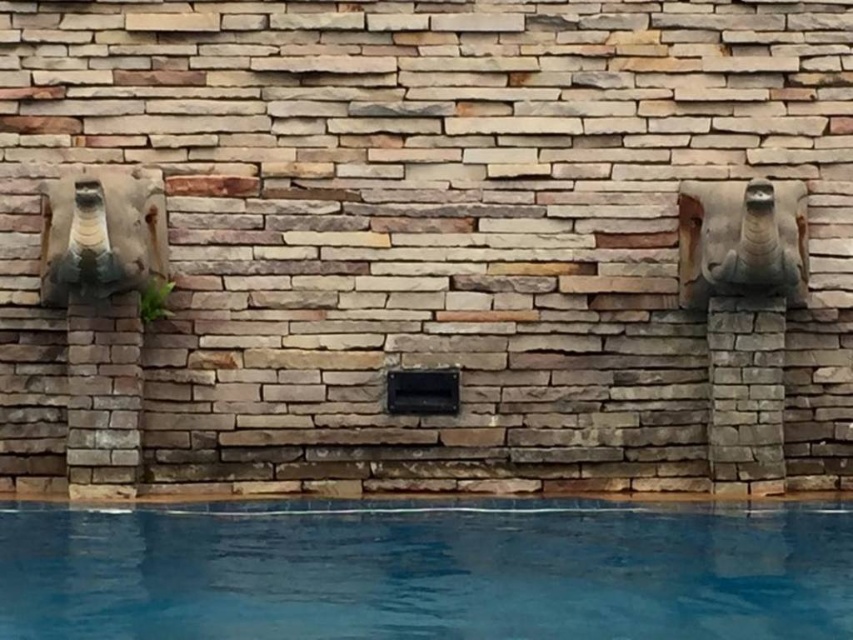
Question: Can you confirm if blue smooth water at bottom is wider than bronze statue at left?

Choices:
 (A) yes
 (B) no

Answer: (A)

Question: Among these points, which one is farthest from the camera?

Choices:
 (A) (140, 227)
 (B) (396, 595)
 (C) (726, 241)

Answer: (A)

Question: From the image, what is the correct spatial relationship of bronze statue at left in relation to stone-like elephant head at right?

Choices:
 (A) above
 (B) below

Answer: (A)

Question: Which of the following is the farthest from the observer?

Choices:
 (A) stone-like elephant head at right
 (B) bronze statue at left

Answer: (A)

Question: Is blue smooth water at bottom to the left of stone-like elephant head at right from the viewer's perspective?

Choices:
 (A) no
 (B) yes

Answer: (B)

Question: Which point is closer to the camera?

Choices:
 (A) bronze statue at left
 (B) stone-like elephant head at right
 (C) blue smooth water at bottom

Answer: (C)